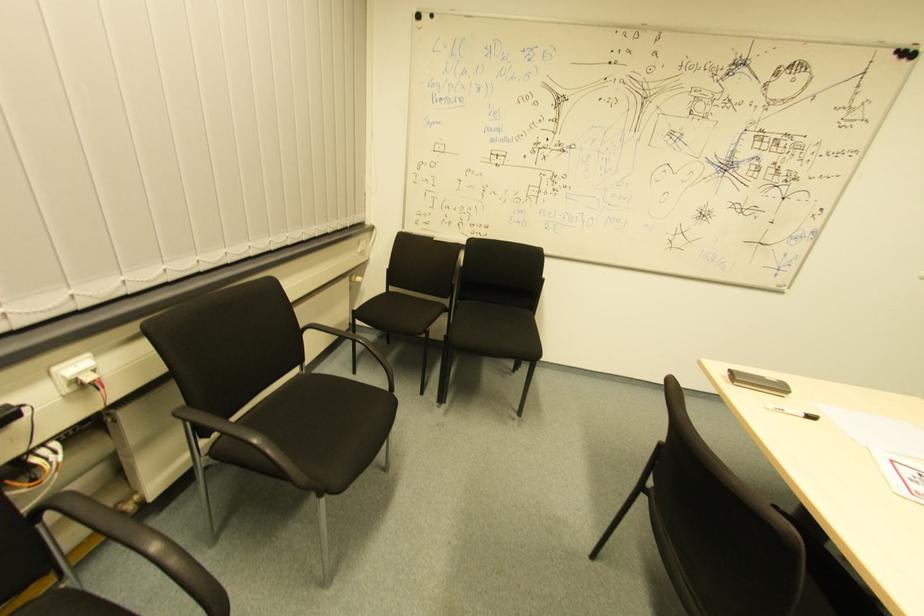
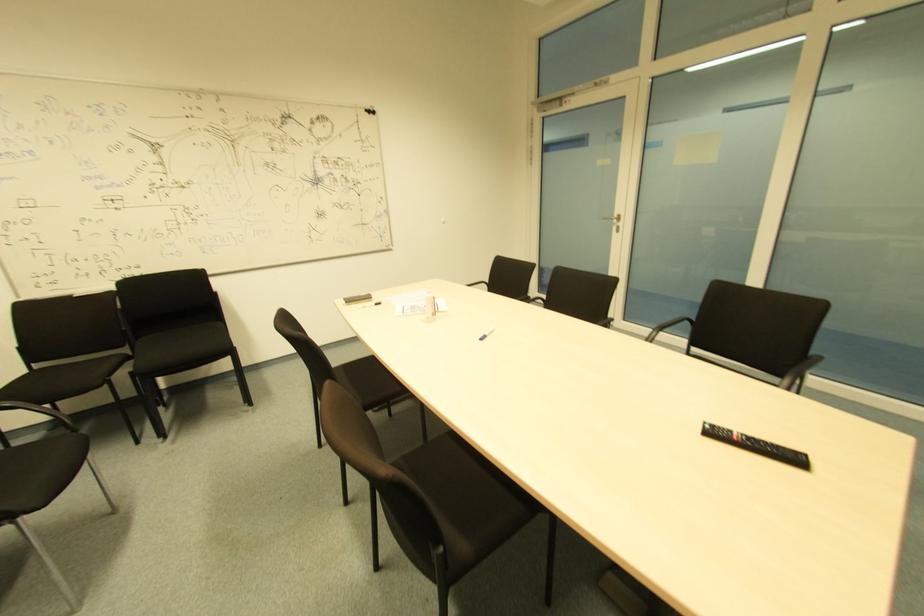
Question: The camera is either moving clockwise (left) or counter-clockwise (right) around the object. The first image is from the beginning of the video and the second image is from the end. Is the camera moving left or right when shooting the video?

Choices:
 (A) Left
 (B) Right

Answer: (A)